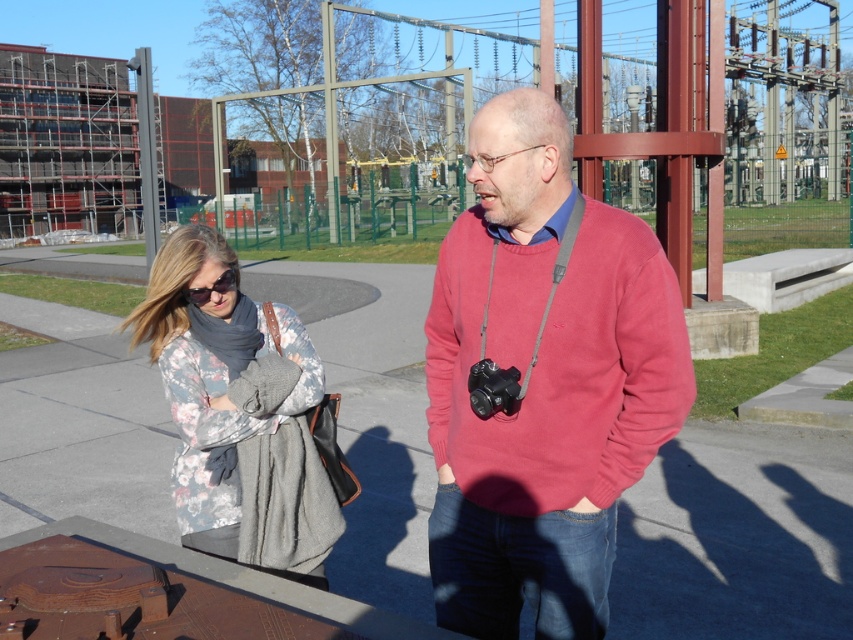
Question: Is matte pink sweater at center positioned at the back of floral-patterned fabric at center?

Choices:
 (A) yes
 (B) no

Answer: (B)

Question: Which object appears farthest from the camera in this image?

Choices:
 (A) matte black sunglasses at center
 (B) matte red sweater at center

Answer: (A)

Question: Which of the following is the farthest from the observer?

Choices:
 (A) 201,467
 (B) 540,168
 (C) 216,282

Answer: (A)

Question: Where is matte red sweater at center located in relation to matte pink sweater at center in the image?

Choices:
 (A) above
 (B) below

Answer: (A)

Question: Which point is farther to the camera?

Choices:
 (A) matte pink sweater at center
 (B) floral-patterned fabric at center
 (C) matte red sweater at center
 (D) matte black sunglasses at center

Answer: (D)

Question: Is matte red sweater at center to the left of floral-patterned fabric at center from the viewer's perspective?

Choices:
 (A) yes
 (B) no

Answer: (B)